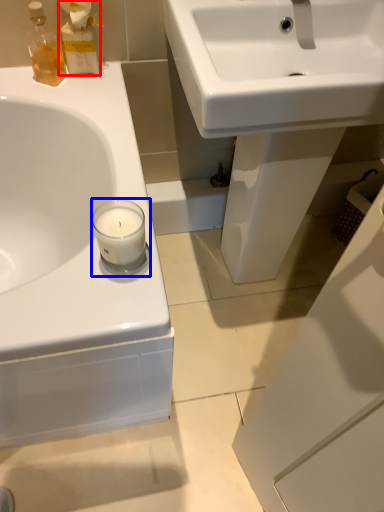
Question: Which object is closer to the camera taking this photo, cleaning product (highlighted by a red box) or candle holder (highlighted by a blue box)?

Choices:
 (A) cleaning product
 (B) candle holder

Answer: (B)